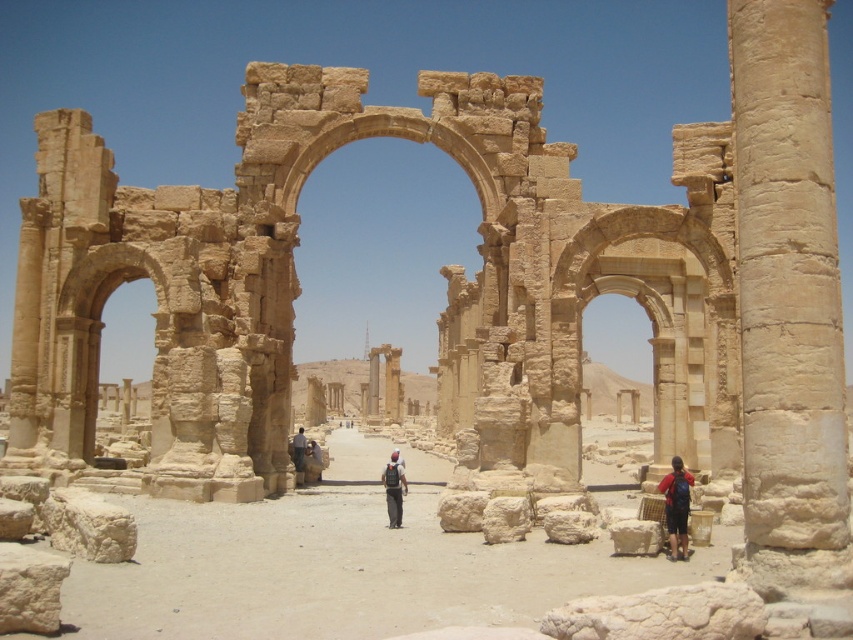
This screenshot has height=640, width=853. Identify the location of dark gray backpack at center. (393, 490).

Can you confirm if dark gray backpack at center is shorter than dark blue fabric backpack at center?

In fact, dark gray backpack at center may be taller than dark blue fabric backpack at center.

Identify the location of dark gray backpack at center. Image resolution: width=853 pixels, height=640 pixels. (393, 490).

Who is positioned more to the left, matte red backpack at lower right or dark gray backpack at center?

Positioned to the left is dark gray backpack at center.

Looking at this image, is the position of matte red backpack at lower right more distant than that of dark gray backpack at center?

No.

Image resolution: width=853 pixels, height=640 pixels. I want to click on matte red backpack at lower right, so click(x=676, y=506).

Can you confirm if beige stone column at right is thinner than dark blue fabric backpack at center?

No.

Which is behind, point (755, 328) or point (300, 438)?

The point (300, 438) is more distant.

Is point (828, 276) in front of point (294, 435)?

Yes.

Where is `beige stone column at right`? beige stone column at right is located at coordinates (788, 301).